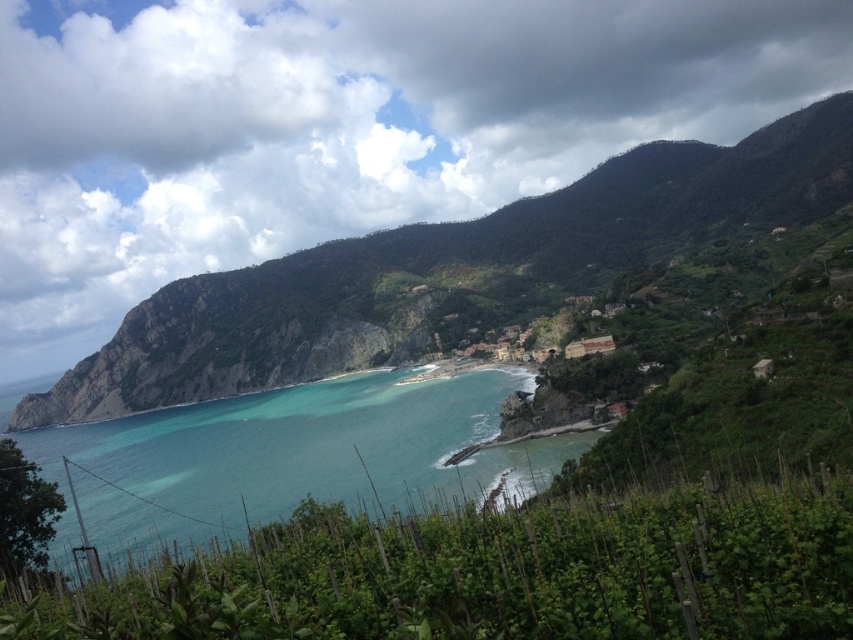
Between green leafy vines at lower center and clear blue water at center, which one appears on the left side from the viewer's perspective?

clear blue water at center is more to the left.

Who is more distant from viewer, (120,614) or (225,525)?

The point (225,525) is more distant.

Locate an element on the screen. The width and height of the screenshot is (853, 640). green leafy vines at lower center is located at coordinates (500, 572).

Where is `green leafy vines at lower center`? This screenshot has height=640, width=853. green leafy vines at lower center is located at coordinates (500, 572).

The width and height of the screenshot is (853, 640). I want to click on green leafy vines at lower center, so (500, 572).

Find the location of a particular element. green leafy vines at lower center is located at coordinates (500, 572).

Is green grassy mountain at center further to the viewer compared to clear blue water at center?

Yes, it is.

Between point (670, 198) and point (389, 380), which one is positioned in front?

Point (389, 380) is in front.

At what (x,y) coordinates should I click in order to perform the action: click on green grassy mountain at center. Please return your answer as a coordinate pair (x, y). Looking at the image, I should click on (450, 272).